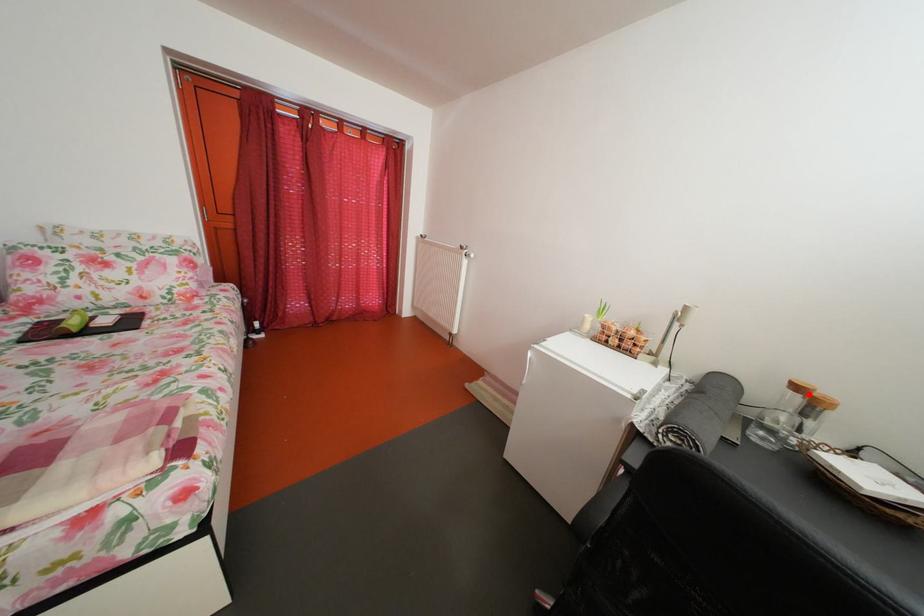
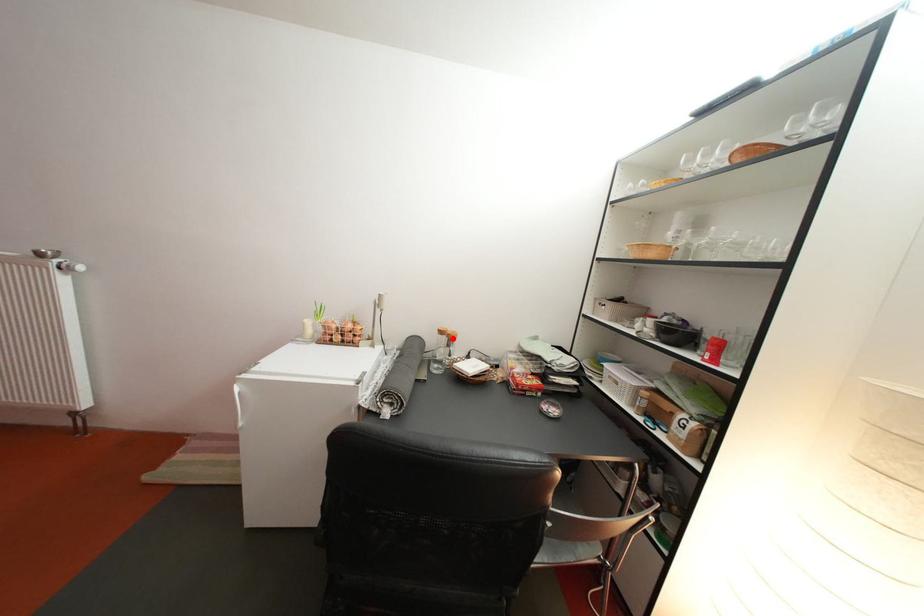
I am providing you with two images of the same scene from different viewpoints. A red point is marked on the first image and another point is marked on the second image. Are the points marked in image1 and image2 representing the same 3D position?

Yes